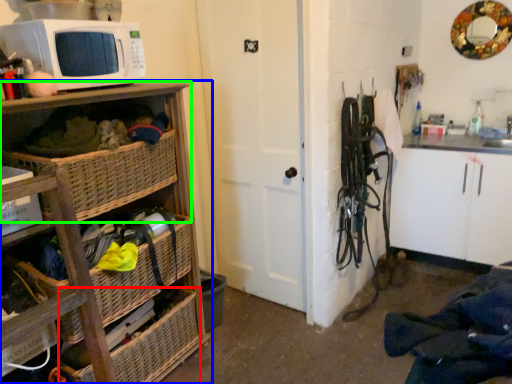
Question: Considering the real-world distances, which object is closest to basket (highlighted by a red box)? cabinetry (highlighted by a blue box) or shelf (highlighted by a green box).

Choices:
 (A) cabinetry
 (B) shelf

Answer: (A)